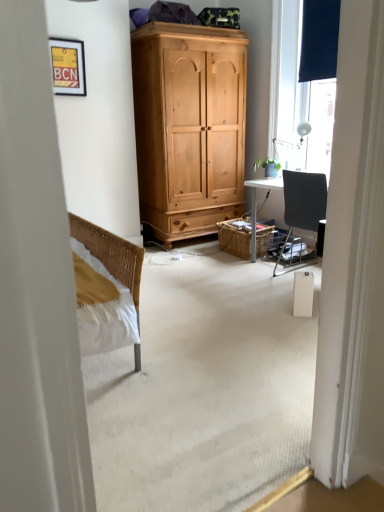
The image size is (384, 512). Describe the element at coordinates (269, 167) in the screenshot. I see `green matte plant at right` at that location.

What do you see at coordinates (298, 96) in the screenshot?
I see `matte black window at upper right` at bounding box center [298, 96].

What is the approximate width of matte black window at upper right?

matte black window at upper right is 9.96 inches wide.

What are the coordinates of `matte yellow picture frame at upper left` in the screenshot? It's located at coord(68,66).

Image resolution: width=384 pixels, height=512 pixels. I want to click on dark matte curtain at upper right, so click(x=319, y=40).

From a real-world perspective, is dark matte curtain at upper right on top of matte black window at upper right?

Indeed, from a real-world perspective, dark matte curtain at upper right stands above matte black window at upper right.

Is dark matte curtain at upper right not within matte black window at upper right?

No, dark matte curtain at upper right is inside or overlapping with matte black window at upper right.

From the image's perspective, is dark matte curtain at upper right below matte black window at upper right?

No.

From the image's perspective, which one is positioned higher, woven brown picnic basket at center or matte black window at upper right?

matte black window at upper right, from the image's perspective.

From a real-world perspective, between woven brown picnic basket at center and matte black window at upper right, who is vertically lower?

woven brown picnic basket at center, from a real-world perspective.

Which is more to the left, woven brown picnic basket at center or matte black window at upper right?

woven brown picnic basket at center is more to the left.

Can we say woven brown picnic basket at center lies outside matte black window at upper right?

That's correct, woven brown picnic basket at center is outside of matte black window at upper right.

Looking at this image, is matte black window at upper right positioned in front of matte yellow picture frame at upper left?

Yes, it is in front of matte yellow picture frame at upper left.

From a real-world perspective, is matte black window at upper right positioned over matte yellow picture frame at upper left based on gravity?

No.

Is matte black window at upper right at the left side of matte yellow picture frame at upper left?

Incorrect, matte black window at upper right is not on the left side of matte yellow picture frame at upper left.

Identify the location of picture frame above the matte black window at upper right (from the image's perspective). This screenshot has width=384, height=512. (68, 66).

Does point (277, 164) lie behind point (317, 10)?

That is True.

From the image's perspective, which is below, green matte plant at right or dark matte curtain at upper right?

green matte plant at right appears lower in the image.

Based on their sizes in the image, would you say green matte plant at right is bigger or smaller than dark matte curtain at upper right?

Considering their sizes, green matte plant at right takes up less space than dark matte curtain at upper right.

Measure the distance from green matte plant at right to matte yellow picture frame at upper left.

green matte plant at right is 6.55 feet away from matte yellow picture frame at upper left.

Can matte yellow picture frame at upper left be found inside green matte plant at right?

No, green matte plant at right does not contain matte yellow picture frame at upper left.

Identify the location of picture frame lying above the green matte plant at right (from the image's perspective). Image resolution: width=384 pixels, height=512 pixels. (68, 66).

From a real-world perspective, who is located higher, green matte plant at right or matte yellow picture frame at upper left?

matte yellow picture frame at upper left.

In terms of size, does matte black window at upper right appear bigger or smaller than green matte plant at right?

Considering their sizes, matte black window at upper right takes up more space than green matte plant at right.

From a real-world perspective, does matte black window at upper right stand above green matte plant at right?

Yes, from a real-world perspective, matte black window at upper right is on top of green matte plant at right.

Would you say green matte plant at right is part of matte black window at upper right's contents?

No, green matte plant at right is located outside of matte black window at upper right.

Locate an element on the screen. This screenshot has height=512, width=384. window on the right of green matte plant at right is located at coordinates (298, 96).

From the image's perspective, does matte yellow picture frame at upper left appear lower than matte black window at upper right?

Actually, matte yellow picture frame at upper left appears above matte black window at upper right in the image.

Considering the sizes of matte yellow picture frame at upper left and matte black window at upper right in the image, is matte yellow picture frame at upper left wider or thinner than matte black window at upper right?

matte yellow picture frame at upper left is wider than matte black window at upper right.

Does point (58, 74) lie behind point (314, 94)?

No.

From a real-world perspective, relative to matte black window at upper right, is matte yellow picture frame at upper left vertically above or below?

In terms of real-world spatial position, matte yellow picture frame at upper left is above matte black window at upper right.

Find the location of `curtain behind the matte black window at upper right`. curtain behind the matte black window at upper right is located at coordinates (319, 40).

What are the coordinates of `window on the right of woven brown picnic basket at center` in the screenshot? It's located at (298, 96).

Estimate the real-world distances between objects in this image. Which object is further from green matte plant at right, matte yellow picture frame at upper left or matte black window at upper right?

matte yellow picture frame at upper left is positioned further to the anchor green matte plant at right.

When comparing their distances from matte yellow picture frame at upper left, does matte black window at upper right or woven brown picnic basket at center seem further?

matte black window at upper right is positioned further to the anchor matte yellow picture frame at upper left.

Based on their spatial positions, is green matte plant at right or matte yellow picture frame at upper left closer to woven brown picnic basket at center?

green matte plant at right is positioned closer to the anchor woven brown picnic basket at center.

Which object lies nearer to the anchor point matte yellow picture frame at upper left, woven brown picnic basket at center or dark matte curtain at upper right?

Based on the image, woven brown picnic basket at center appears to be nearer to matte yellow picture frame at upper left.

Looking at this image, when comparing their distances from woven brown picnic basket at center, does dark matte curtain at upper right or green matte plant at right seem closer?

The object closer to woven brown picnic basket at center is green matte plant at right.

Consider the image. Which object lies further to the anchor point matte black window at upper right, green matte plant at right or matte yellow picture frame at upper left?

matte yellow picture frame at upper left is positioned further to the anchor matte black window at upper right.

Which object lies further to the anchor point matte black window at upper right, woven brown picnic basket at center or dark matte curtain at upper right?

woven brown picnic basket at center.

Considering their positions, is matte yellow picture frame at upper left positioned closer to green matte plant at right than dark matte curtain at upper right?

The object closer to green matte plant at right is dark matte curtain at upper right.

Identify the location of curtain between matte yellow picture frame at upper left and matte black window at upper right. (319, 40).

Find the location of a particular element. The image size is (384, 512). houseplant between matte yellow picture frame at upper left and dark matte curtain at upper right is located at coordinates (269, 167).

Locate an element on the screen. This screenshot has height=512, width=384. picnic basket between matte yellow picture frame at upper left and green matte plant at right in the horizontal direction is located at coordinates (235, 238).

At what (x,y) coordinates should I click in order to perform the action: click on houseplant located between matte yellow picture frame at upper left and matte black window at upper right in the left-right direction. Please return your answer as a coordinate pair (x, y). The width and height of the screenshot is (384, 512). Looking at the image, I should click on (269, 167).